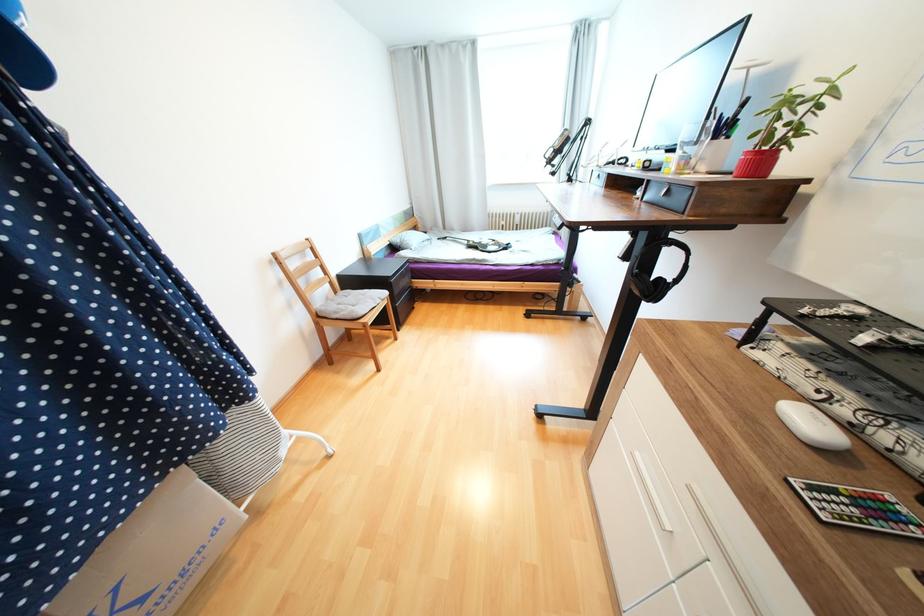
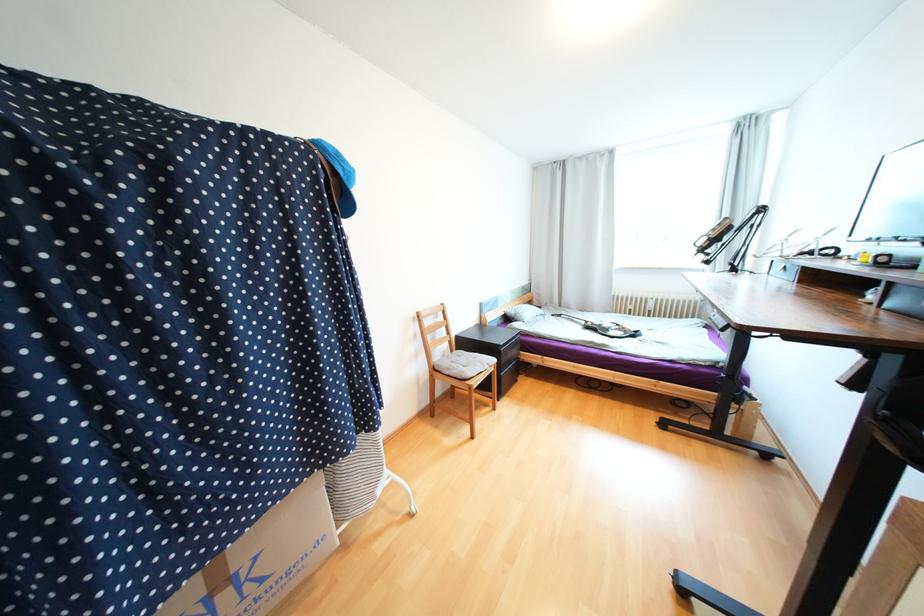
Question: The camera is either moving clockwise (left) or counter-clockwise (right) around the object. The first image is from the beginning of the video and the second image is from the end. Is the camera moving left or right when shooting the video?

Choices:
 (A) Left
 (B) Right

Answer: (B)